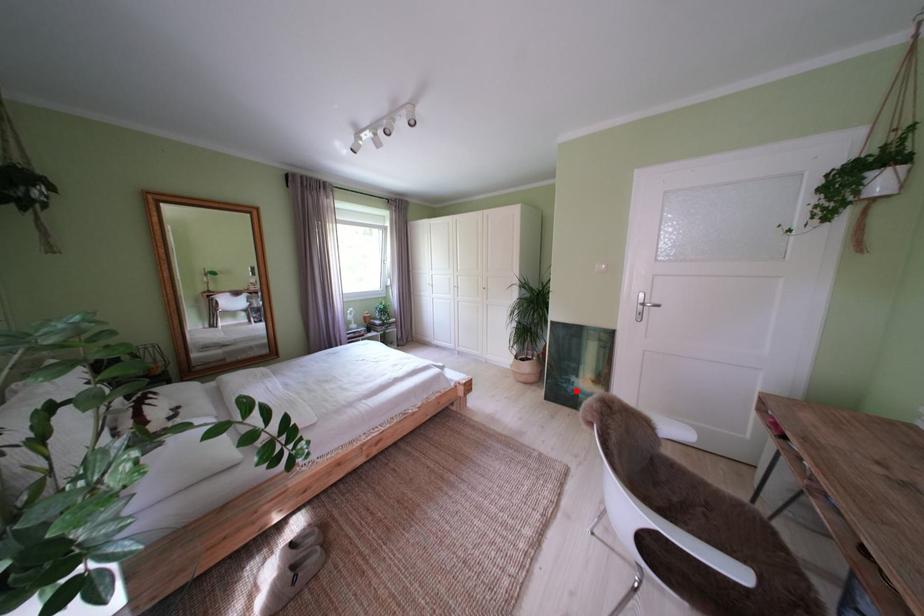
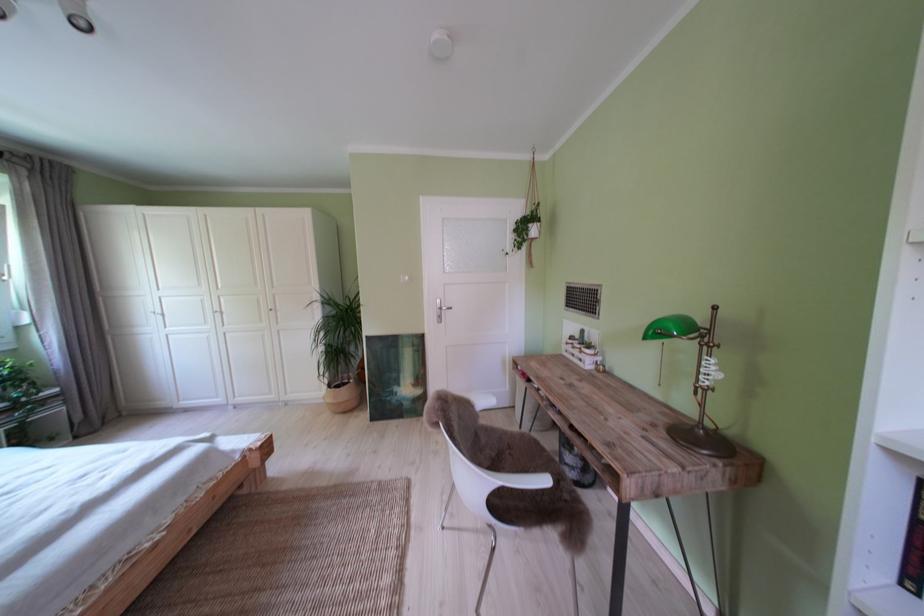
Question: I am providing you with two images of the same scene from different viewpoints. A red point is shown in image1. For the corresponding object point in image2, is it positioned nearer or farther from the camera?

Choices:
 (A) Nearer
 (B) Farther

Answer: (B)